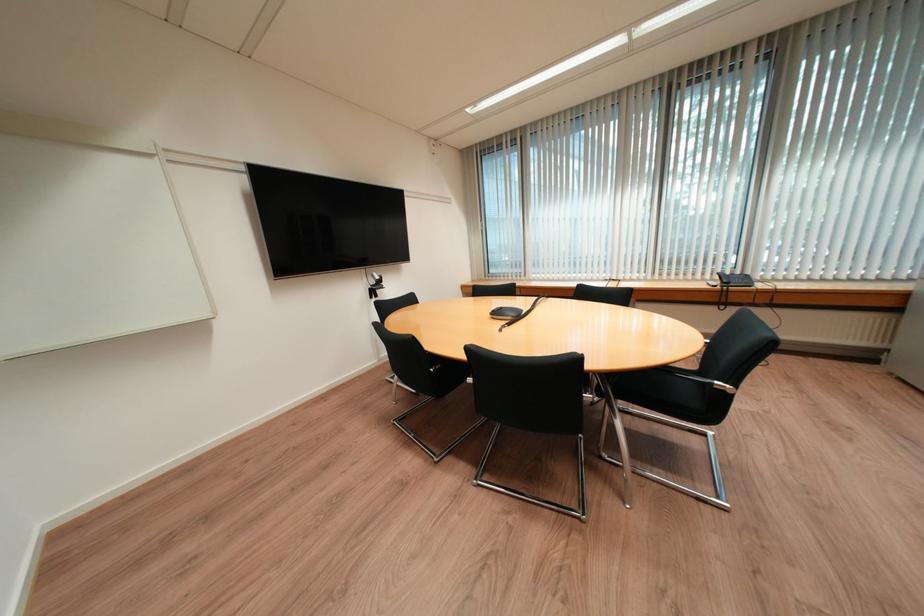
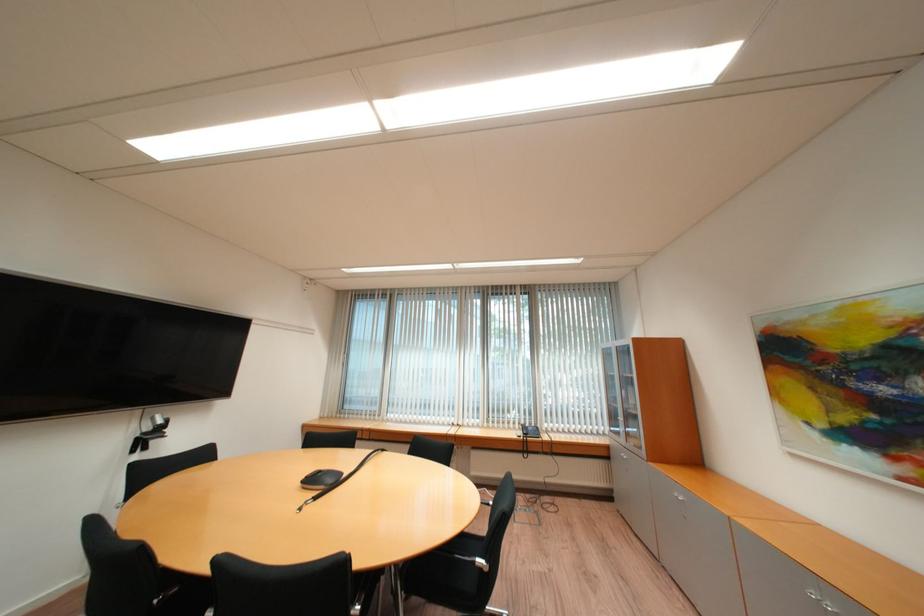
In the second image, find the point that corresponds to point 382,277 in the first image.

(162, 419)